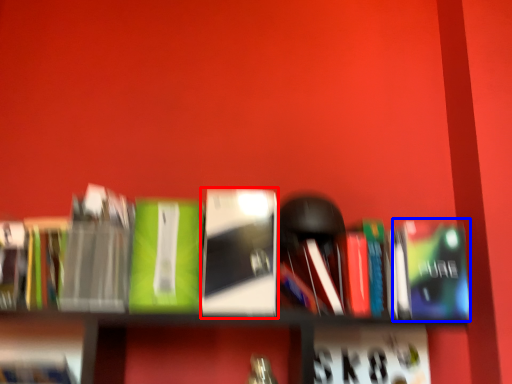
Question: Which of the following is the farthest to the observer, book (highlighted by a red box) or paperback book (highlighted by a blue box)?

Choices:
 (A) book
 (B) paperback book

Answer: (B)